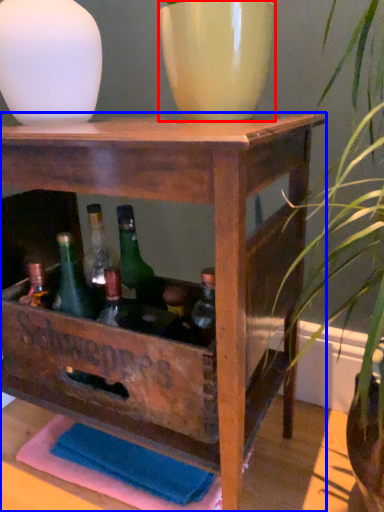
Question: Among these objects, which one is farthest to the camera, flowerpot (highlighted by a red box) or table (highlighted by a blue box)?

Choices:
 (A) flowerpot
 (B) table

Answer: (A)